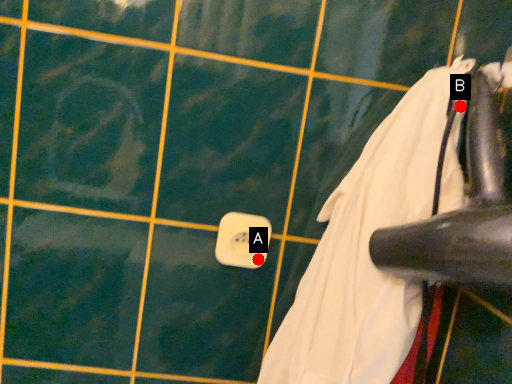
Question: Two points are circled on the image, labeled by A and B beside each circle. Which of the following is the closest to the observer?

Choices:
 (A) A is closer
 (B) B is closer

Answer: (B)